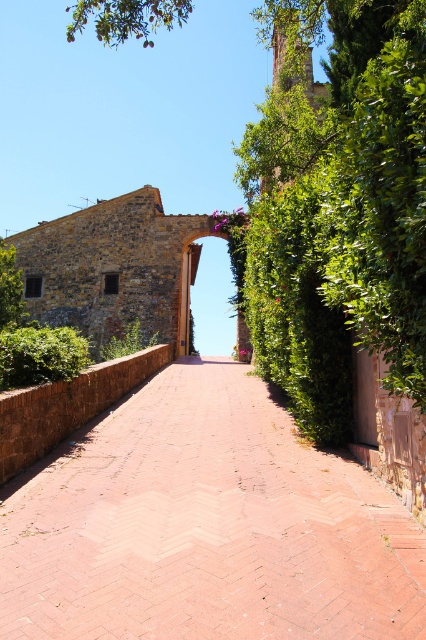
What do you see at coordinates (204, 525) in the screenshot? The image size is (426, 640). I see `brick paved path at center` at bounding box center [204, 525].

Between point (249, 436) and point (222, 252), which one is positioned in front?

Point (249, 436) is more forward.

Is point (402, 618) closer to camera compared to point (213, 256)?

Yes, point (402, 618) is closer to viewer.

This screenshot has width=426, height=640. Find the location of `brick paved path at center`. brick paved path at center is located at coordinates (204, 525).

Does green leafy tree at center appear on the right side of stone archway at center?

Incorrect, green leafy tree at center is not on the right side of stone archway at center.

Which of these two, green leafy tree at center or stone archway at center, stands shorter?

With less height is stone archway at center.

Who is more forward, (417, 285) or (226, 259)?

Point (417, 285)

This screenshot has width=426, height=640. I want to click on green leafy tree at center, so [356, 166].

Between brick paved path at center and green leafy tree at center, which one is positioned lower?

brick paved path at center is below.

Based on the photo, can you confirm if brick paved path at center is positioned to the left of green leafy tree at center?

In fact, brick paved path at center is to the right of green leafy tree at center.

I want to click on brick paved path at center, so click(x=204, y=525).

Where is `brick paved path at center`? brick paved path at center is located at coordinates (204, 525).